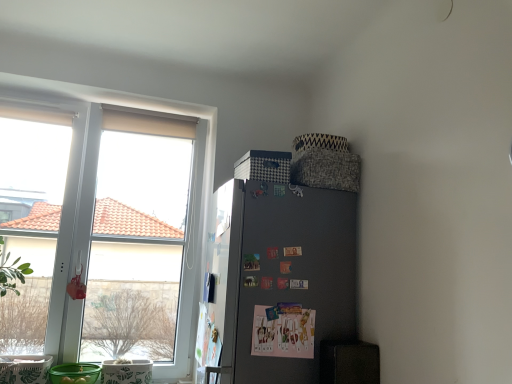
Question: In terms of width, does white matte window at upper left look wider or thinner when compared to satin black fridge at right?

Choices:
 (A) wide
 (B) thin

Answer: (B)

Question: Is white matte window at upper left inside or outside of satin black fridge at right?

Choices:
 (A) outside
 (B) inside

Answer: (A)

Question: Considering the relative positions of white matte window at upper left and satin black fridge at right in the image provided, is white matte window at upper left to the left or to the right of satin black fridge at right?

Choices:
 (A) right
 (B) left

Answer: (B)

Question: Is satin black fridge at right situated inside white matte window at upper left or outside?

Choices:
 (A) outside
 (B) inside

Answer: (A)

Question: Is satin black fridge at right in front of or behind white matte window at upper left in the image?

Choices:
 (A) behind
 (B) front

Answer: (B)

Question: Does point (260, 259) appear closer or farther from the camera than point (200, 195)?

Choices:
 (A) closer
 (B) farther

Answer: (A)

Question: Is satin black fridge at right wider or thinner than white matte window at upper left?

Choices:
 (A) wide
 (B) thin

Answer: (A)